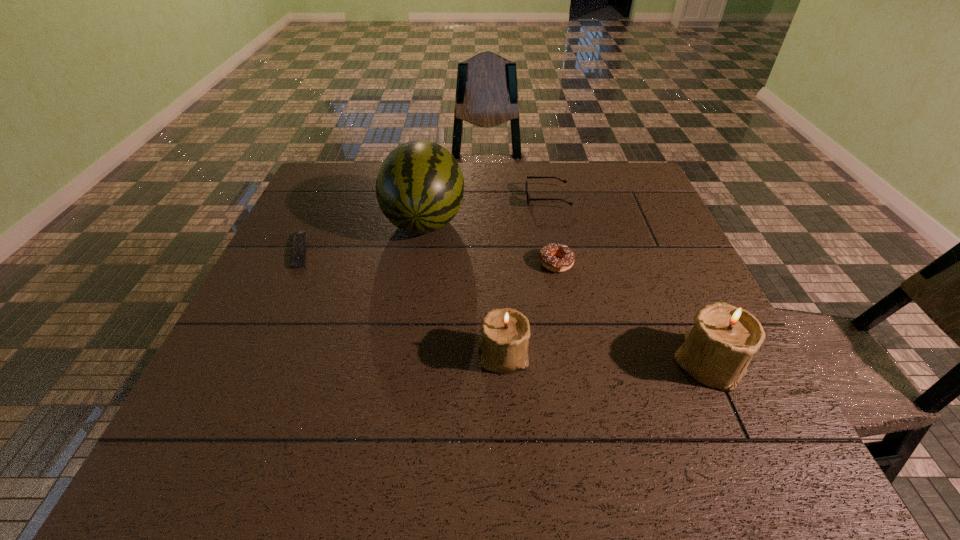
The height and width of the screenshot is (540, 960). What are the coordinates of `object that is at the left edge` in the screenshot? It's located at (298, 259).

Identify the location of object that is at the right edge. (717, 350).

What are the coordinates of `object positioned at the near right corner` in the screenshot? It's located at (717, 350).

In the image, there is a desktop. Identify the location of vacant space at the far edge. This screenshot has height=540, width=960. (517, 165).

At what (x,y) coordinates should I click in order to perform the action: click on vacant point at the near edge. Please return your answer as a coordinate pair (x, y). Looking at the image, I should click on (329, 375).

This screenshot has width=960, height=540. I want to click on free space at the left edge, so click(x=324, y=277).

Where is `free space at the right edge of the desktop`? The width and height of the screenshot is (960, 540). free space at the right edge of the desktop is located at coordinates (684, 299).

This screenshot has height=540, width=960. I want to click on vacant position at the far left corner of the desktop, so click(317, 201).

I want to click on free space between the watermelon and the taller candle_holder, so click(x=566, y=291).

The height and width of the screenshot is (540, 960). I want to click on free point between the shorter candle_holder and the rightmost object, so click(x=606, y=359).